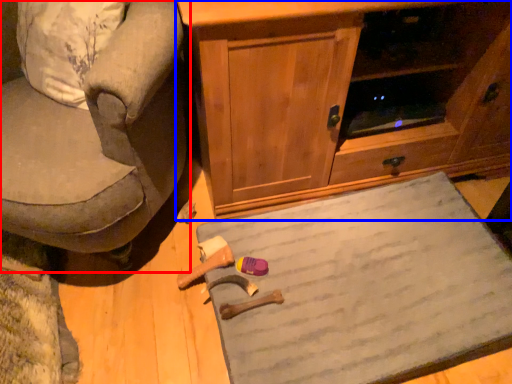
Question: Among these objects, which one is farthest to the camera, chair (highlighted by a red box) or cabinetry (highlighted by a blue box)?

Choices:
 (A) chair
 (B) cabinetry

Answer: (B)